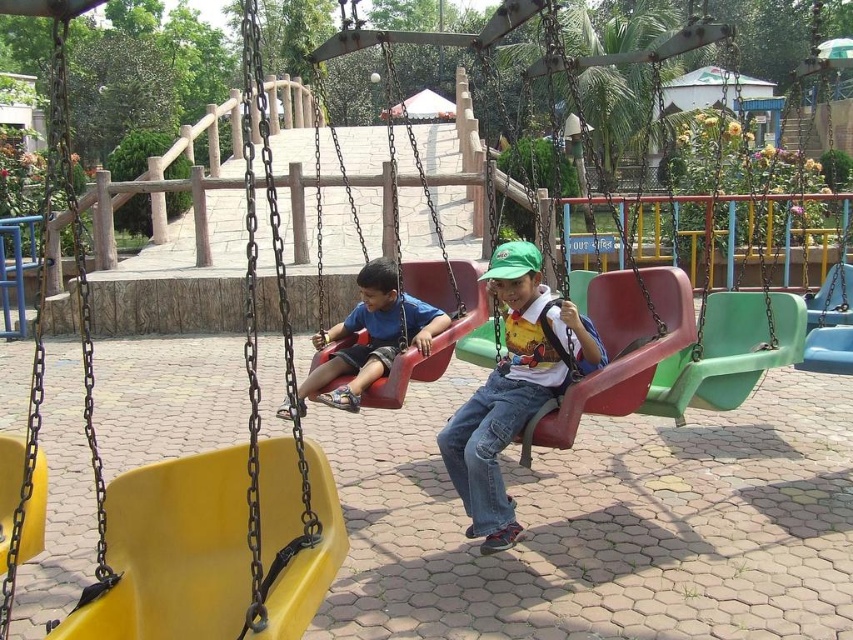
Question: Which point is closer to the camera?

Choices:
 (A) (393, 349)
 (B) (480, 465)

Answer: (B)

Question: Which point is farther from the camera taking this photo?

Choices:
 (A) (480, 385)
 (B) (328, 404)

Answer: (A)

Question: Can you confirm if matte green cap at center is positioned above matte blue shirt at center?

Choices:
 (A) no
 (B) yes

Answer: (A)

Question: Is matte green cap at center smaller than matte blue shirt at center?

Choices:
 (A) no
 (B) yes

Answer: (B)

Question: Can you confirm if matte green cap at center is smaller than matte blue shirt at center?

Choices:
 (A) no
 (B) yes

Answer: (B)